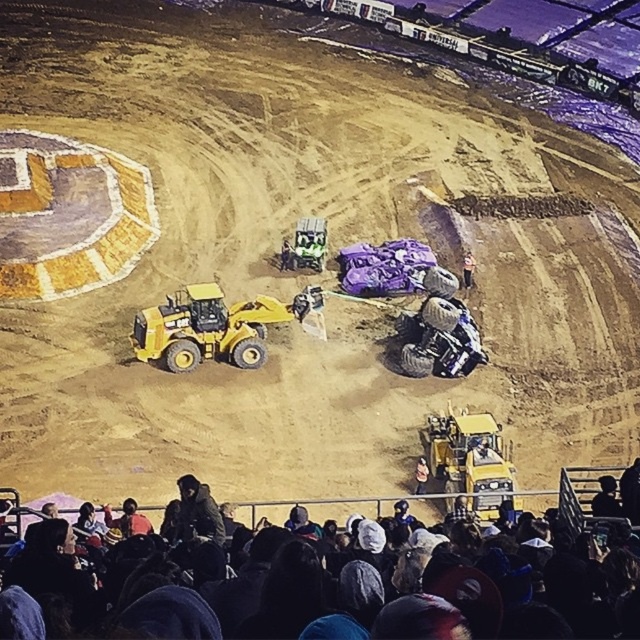
Based on the photo, you are a photographer standing at the edge of the track. You want to take a photo of the dark gray jacket at lower left and the light brown leather jacket at lower center. Which jacket should you zoom in on to capture both in the frame without moving the camera?

You should zoom in on the light brown leather jacket at lower center because it is smaller than the dark gray jacket at lower left, allowing both to fit within the camera frame when zoomed appropriately.

You are a photographer standing at the edge of the track. You want to take a photo of the light brown leather jacket at lower center without the dark gray jacket at lower left blocking it. Is this possible given their positions?

The dark gray jacket at lower left is positioned over the light brown leather jacket at lower center, so taking a photo of the light brown leather jacket at lower center without the dark gray jacket at lower left blocking it would not be possible as it is currently obstructing the view.